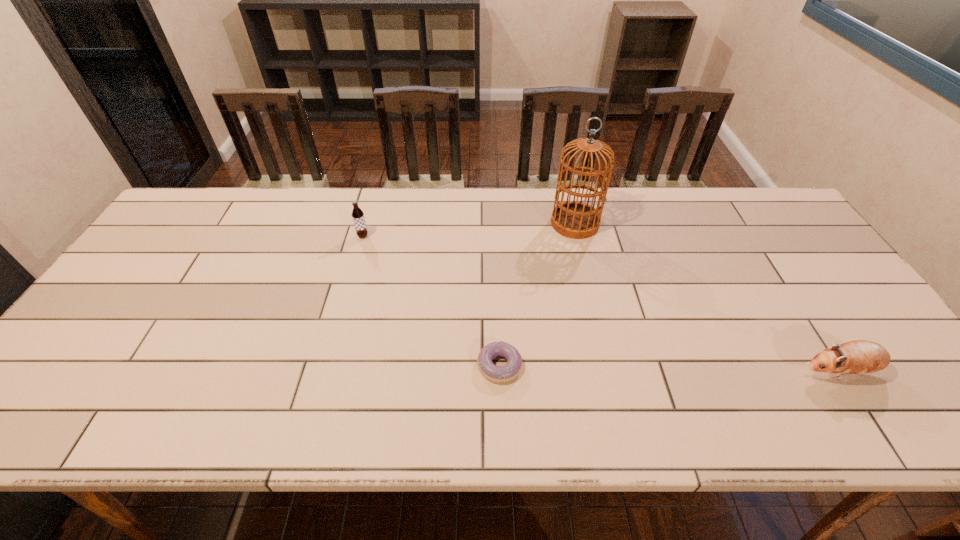
Locate an element on the screen. The width and height of the screenshot is (960, 540). unoccupied area between the third shortest object and the shortest object is located at coordinates (431, 301).

You are a GUI agent. You are given a task and a screenshot of the screen. Output one action in this format:
    pyautogui.click(x=<x>, y=<y>)
    Task: Click on the free space between the doughnut and the third object from left to right
    The height and width of the screenshot is (540, 960).
    Given the screenshot: What is the action you would take?
    pyautogui.click(x=538, y=294)

Locate an element on the screen. The image size is (960, 540). vacant space that is in between the leftmost object and the third tallest object is located at coordinates (601, 304).

Find the location of a particular element. The height and width of the screenshot is (540, 960). free space between the second shortest object and the second object from left to right is located at coordinates (669, 369).

Where is `free point between the doughnut and the tallest object`? free point between the doughnut and the tallest object is located at coordinates (538, 294).

Image resolution: width=960 pixels, height=540 pixels. What are the coordinates of `vacant space that's between the leftmost object and the second shortest object` in the screenshot? It's located at (601, 304).

Find the location of `free area in between the birdcage and the hamster`. free area in between the birdcage and the hamster is located at coordinates (707, 298).

Where is `vacant space that's between the third object from right to left and the third shortest object`? vacant space that's between the third object from right to left and the third shortest object is located at coordinates (431, 301).

This screenshot has width=960, height=540. I want to click on vacant space that is in between the third tallest object and the birdcage, so click(707, 298).

The width and height of the screenshot is (960, 540). Find the location of `free space that is in between the rightmost object and the third object from right to left`. free space that is in between the rightmost object and the third object from right to left is located at coordinates (669, 369).